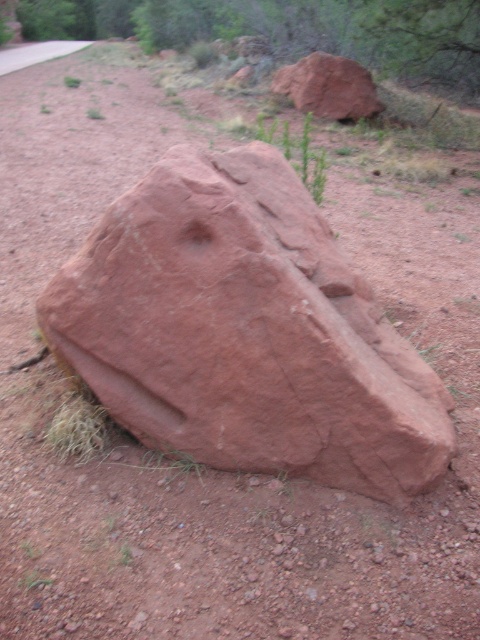
Between green leafy plant at center and smooth concrete path at upper left, which one has less height?

green leafy plant at center is shorter.

Looking at this image, can you confirm if green leafy plant at center is positioned above smooth concrete path at upper left?

Actually, green leafy plant at center is below smooth concrete path at upper left.

Is point (323, 186) positioned before point (78, 45)?

That is True.

Find the location of a particular element. The width and height of the screenshot is (480, 640). green leafy plant at center is located at coordinates (298, 152).

In the scene shown: Is rusty stone boulder at upper center wider than green leafy plant at center?

Yes, rusty stone boulder at upper center is wider than green leafy plant at center.

Is rusty stone boulder at upper center below green leafy plant at center?

No, rusty stone boulder at upper center is not below green leafy plant at center.

Is point (360, 90) more distant than point (323, 170)?

Yes, point (360, 90) is behind point (323, 170).

Where is `rusty stone boulder at upper center`? This screenshot has width=480, height=640. rusty stone boulder at upper center is located at coordinates (328, 86).

Consider the image. Can you confirm if rusty stone boulder at upper center is smaller than smooth concrete path at upper left?

Indeed, rusty stone boulder at upper center has a smaller size compared to smooth concrete path at upper left.

Does point (277, 92) come in front of point (14, 58)?

That is True.

Find the location of a particular element. The image size is (480, 640). rusty stone boulder at upper center is located at coordinates (328, 86).